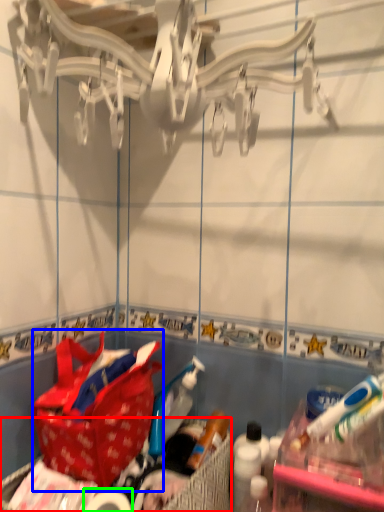
Question: Based on their relative distances, which object is nearer to picnic basket (highlighted by a red box)? Choose from handbag (highlighted by a blue box) and toilet paper (highlighted by a green box).

Choices:
 (A) handbag
 (B) toilet paper

Answer: (B)